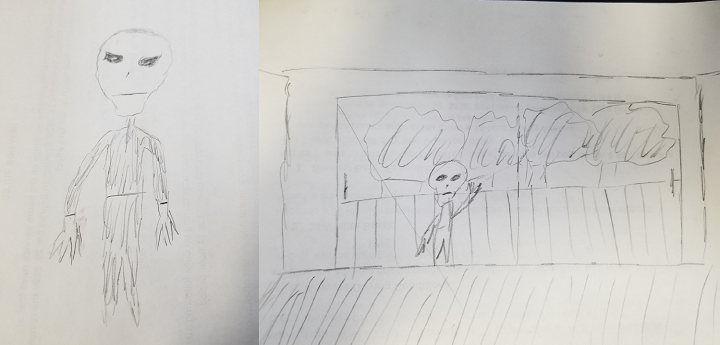
This screenshot has width=720, height=345. In order to click on walls in this screenshot , I will do `click(315, 180)`, `click(276, 196)`.